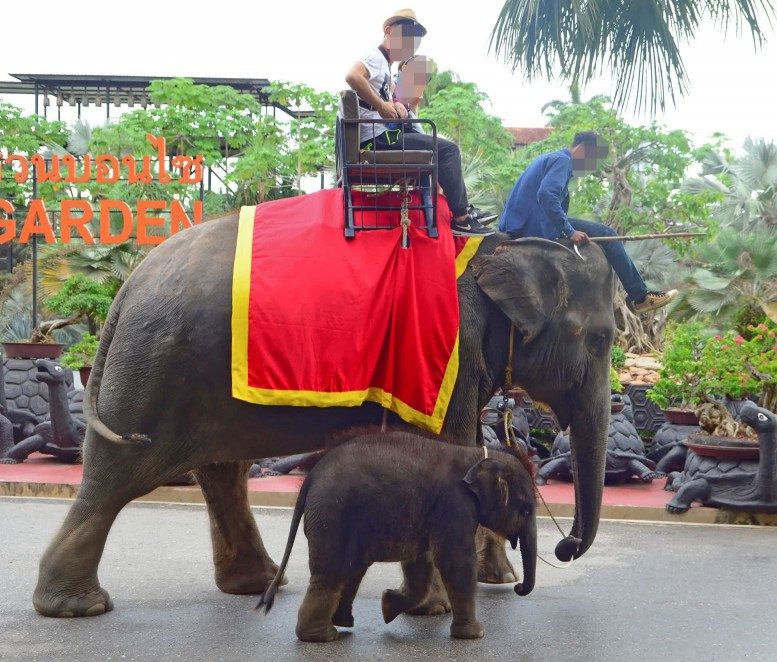
Locate an element on the screen. Image resolution: width=777 pixels, height=662 pixels. cover blanket is located at coordinates pos(336,303).